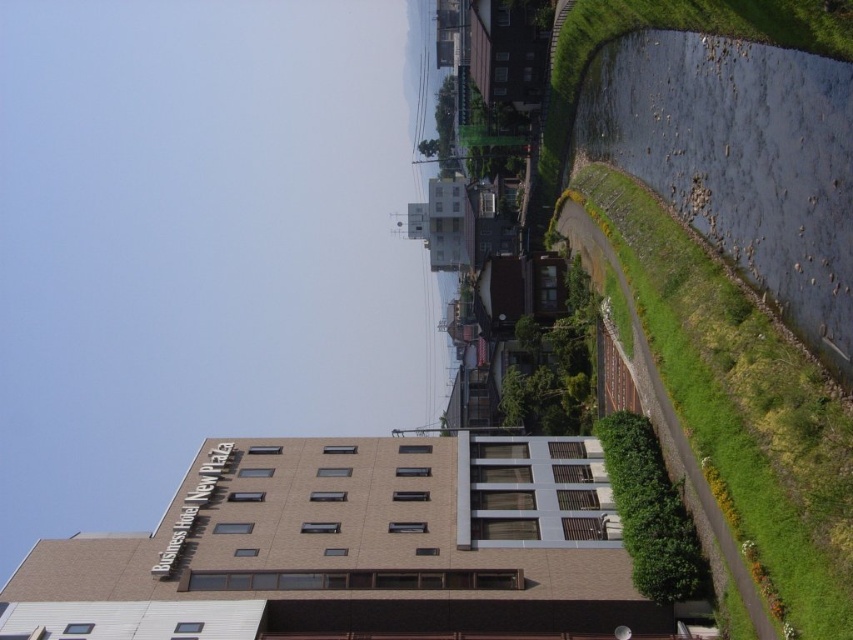
Looking at this image, you are a drone operator who needs to fly a drone from the brown brick building at center to the green grass at right. Considering the height difference between them, will the drone need to ascend or descend to reach the destination?

The brown brick building at center has a lesser height compared to green grass at right, so the drone will need to ascend to reach the green grass at right.

You are standing at the origin point of the coordinate system in the image. Which direction should you move to reach the brown brick building at center?

Since the brown brick building at center is located at coordinate point (358,545), you should move towards the right and slightly upwards to reach it from the origin point.